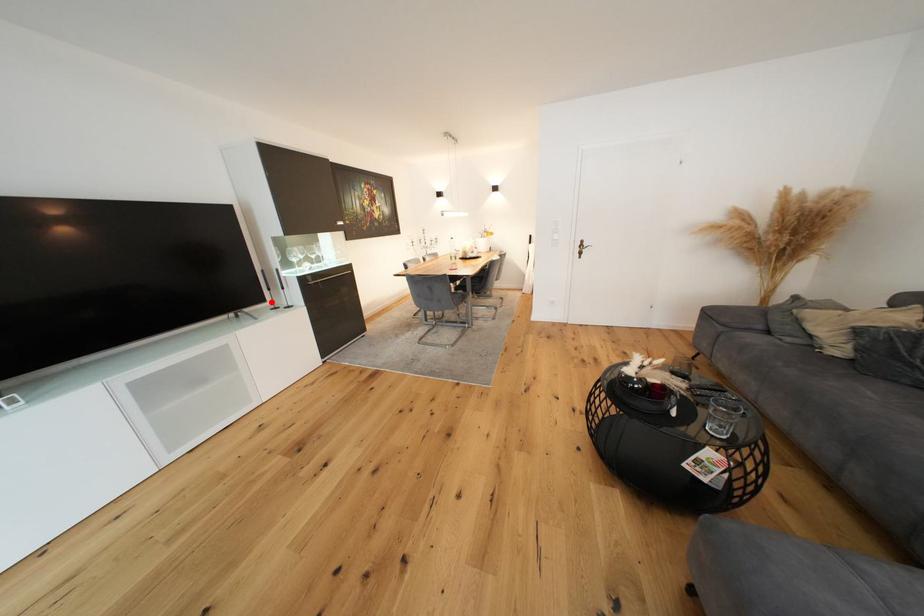
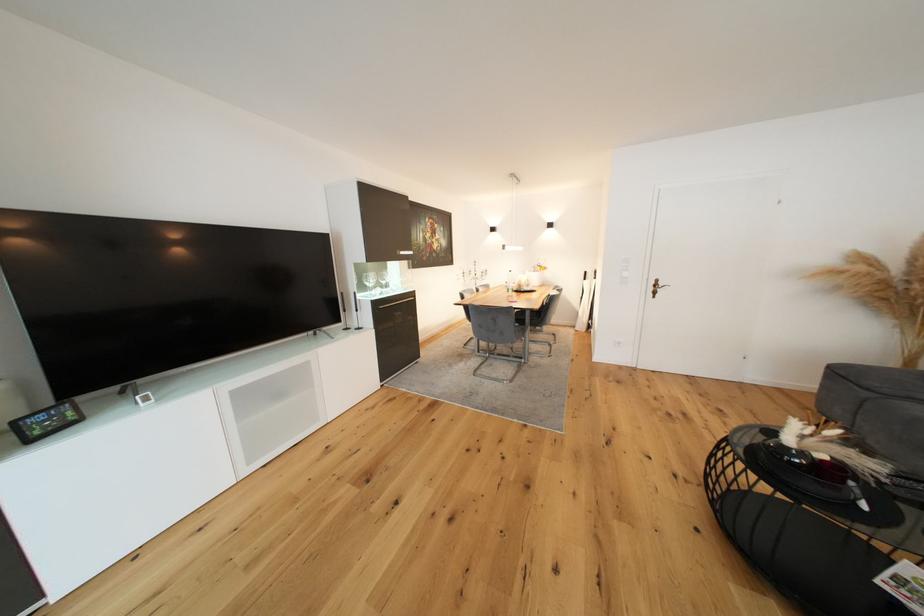
Find the pixel in the second image that matches the highlighted location in the first image.

(346, 323)